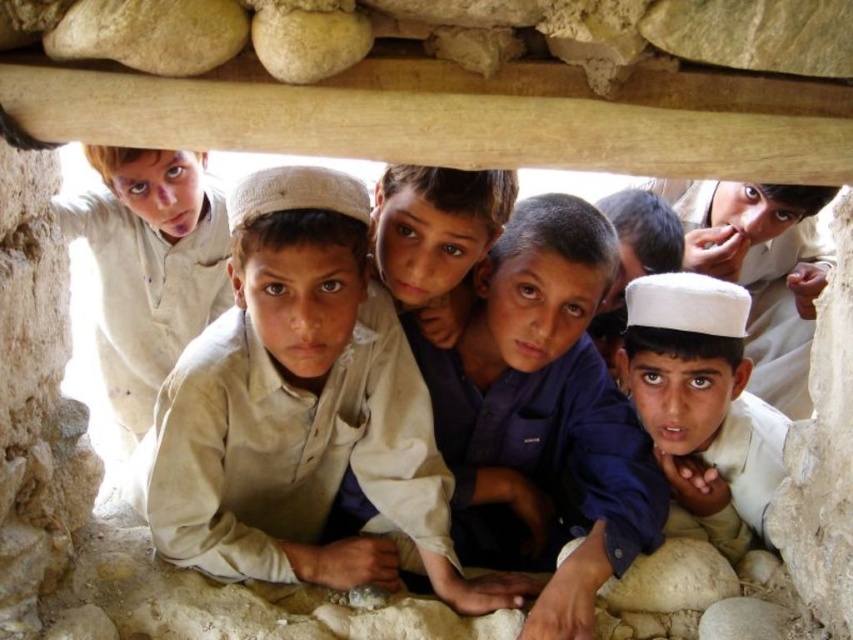
Which of these two, light beige cotton shirt at center or blue cotton shirt at center, stands taller?

blue cotton shirt at center is taller.

Which is more to the left, light beige cotton shirt at center or blue cotton shirt at center?

light beige cotton shirt at center is more to the left.

This screenshot has height=640, width=853. In order to click on light beige cotton shirt at center in this screenshot , I will do `click(300, 410)`.

Is light beige cotton shirt at center to the right of white matte cap at center from the viewer's perspective?

No, light beige cotton shirt at center is not to the right of white matte cap at center.

Describe the element at coordinates (300, 410) in the screenshot. The width and height of the screenshot is (853, 640). I see `light beige cotton shirt at center` at that location.

Is point (260, 186) less distant than point (653, 275)?

Yes, point (260, 186) is closer to viewer.

This screenshot has width=853, height=640. I want to click on light beige cotton shirt at center, so click(x=300, y=410).

Is blue cotton shirt at center to the left of white matte cap at center from the viewer's perspective?

Correct, you'll find blue cotton shirt at center to the left of white matte cap at center.

Is point (587, 492) positioned behind point (669, 406)?

Yes, it is.

I want to click on blue cotton shirt at center, so click(543, 417).